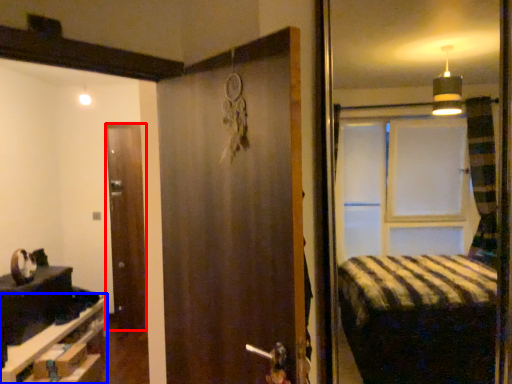
Question: Which object appears closest to the camera in this image, door (highlighted by a red box) or furniture (highlighted by a blue box)?

Choices:
 (A) door
 (B) furniture

Answer: (B)